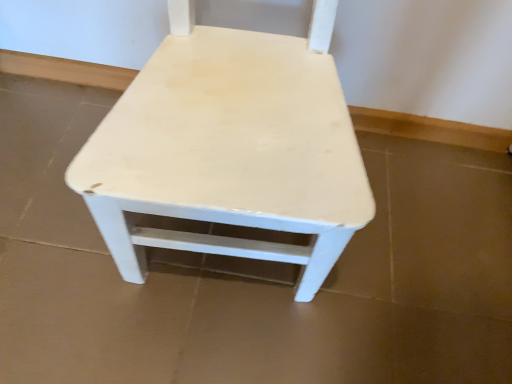
Identify the location of white matte wood chair at center. (230, 148).

Measure the distance between white matte wood chair at center and camera.

white matte wood chair at center and camera are 16.30 inches apart from each other.

What do you see at coordinates (230, 148) in the screenshot?
I see `white matte wood chair at center` at bounding box center [230, 148].

I want to click on white matte wood chair at center, so click(230, 148).